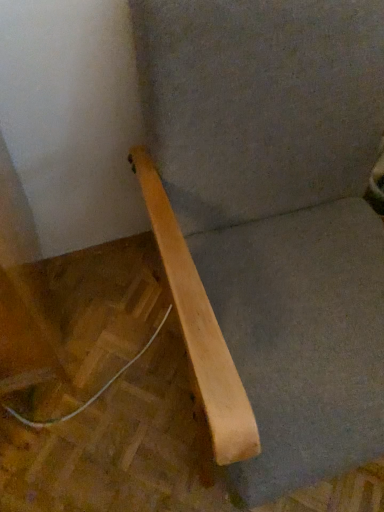
Where is `natural wood chair at lower right`? Image resolution: width=384 pixels, height=512 pixels. natural wood chair at lower right is located at coordinates (279, 211).

Image resolution: width=384 pixels, height=512 pixels. Describe the element at coordinates (279, 211) in the screenshot. I see `natural wood chair at lower right` at that location.

What is the approximate height of natural wood chair at lower right?

32.20 inches.

Identify the location of natural wood chair at lower right. This screenshot has height=512, width=384. (279, 211).